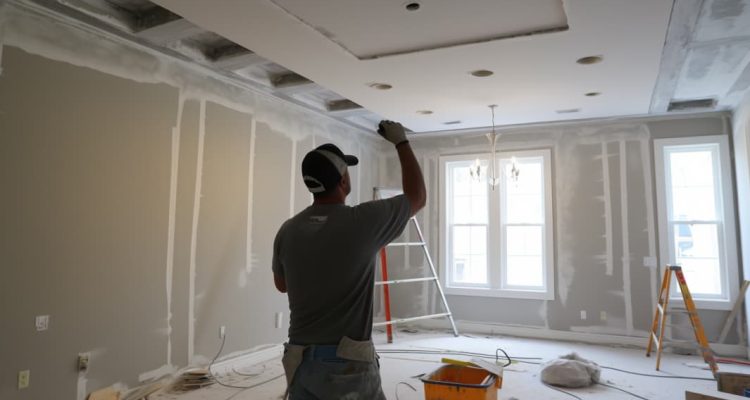
Find the location of a particular element. The image size is (750, 400). drywall is located at coordinates (57, 203), (216, 203), (580, 212).